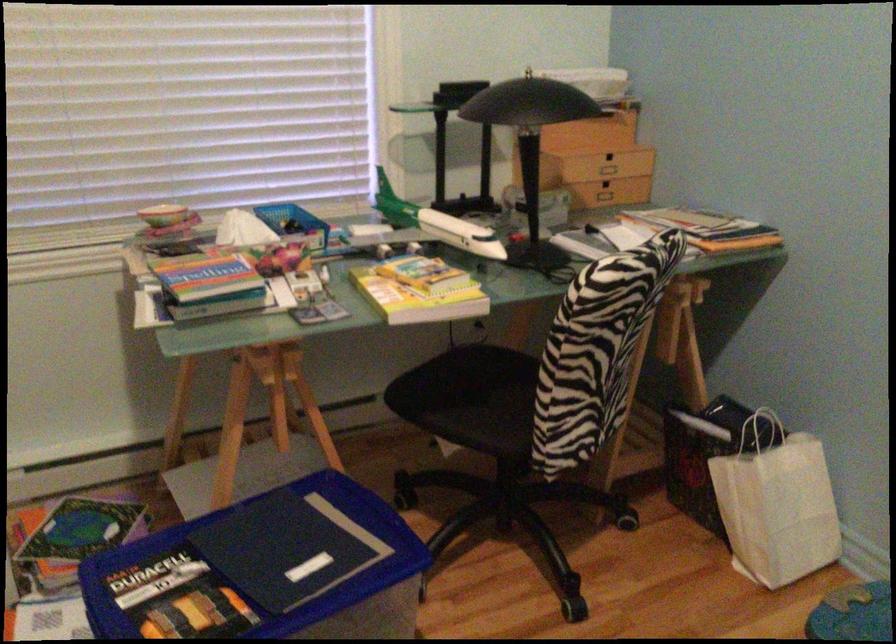
Where is `yellow textbook`? The width and height of the screenshot is (896, 644). yellow textbook is located at coordinates pos(419,290).